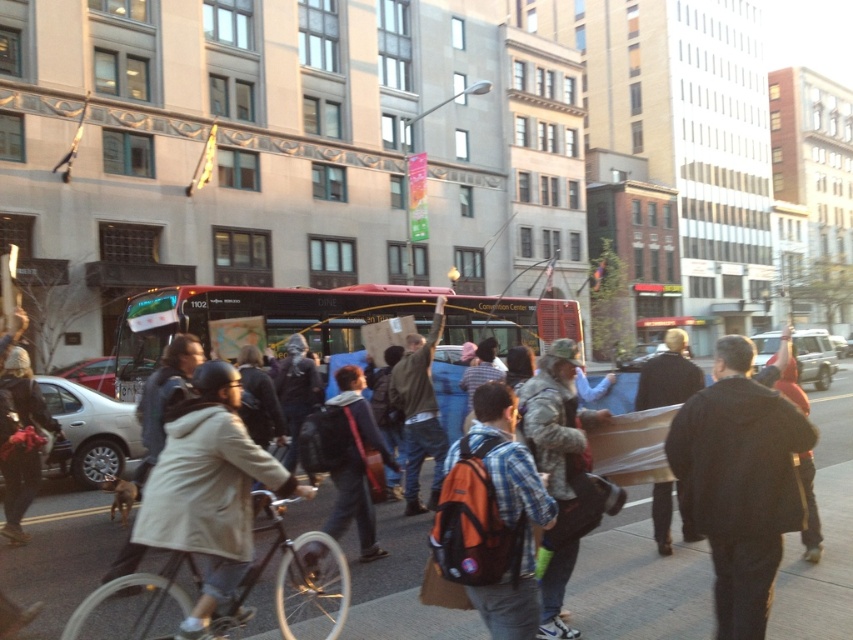
Question: Based on their relative distances, which object is farther from the dark gray jacket at center?

Choices:
 (A) black matte bicycle at center
 (B) camouflage jacket at center

Answer: (B)

Question: Is dark brown leather jacket at right smaller than metallic silver suv at center-right?

Choices:
 (A) yes
 (B) no

Answer: (A)

Question: Which object is farther from the camera taking this photo?

Choices:
 (A) black matte bicycle at center
 (B) dark gray jacket at lower left
 (C) red matte bus at center

Answer: (C)

Question: Based on their relative distances, which object is farther from the black leather jacket at center?

Choices:
 (A) dark brown leather jacket at right
 (B) beige wool coat at center
 (C) plaid fabric shirt at center

Answer: (A)

Question: Is beige wool coat at center to the right of dark gray jacket at center from the viewer's perspective?

Choices:
 (A) yes
 (B) no

Answer: (B)

Question: Is red matte bus at center in front of metallic silver suv at center-right?

Choices:
 (A) yes
 (B) no

Answer: (B)